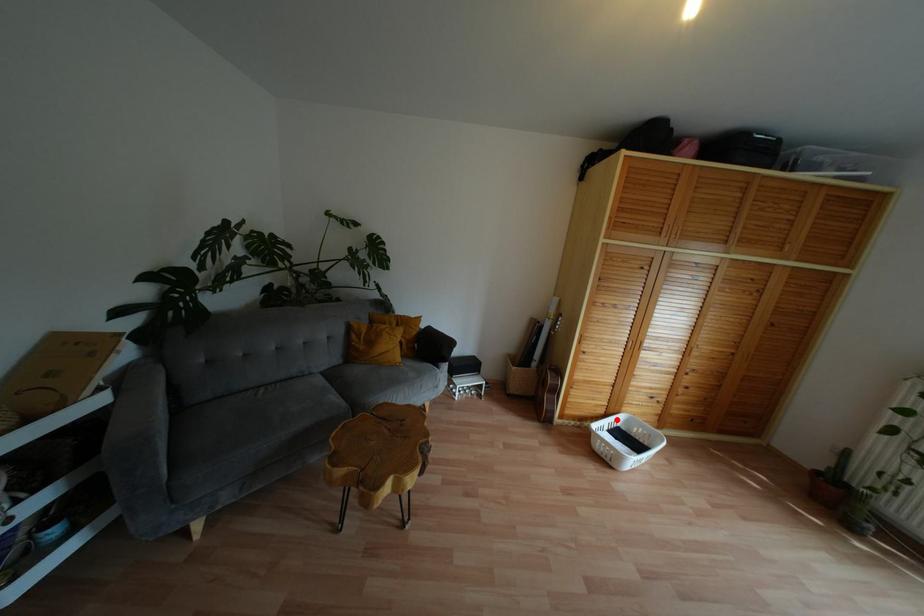
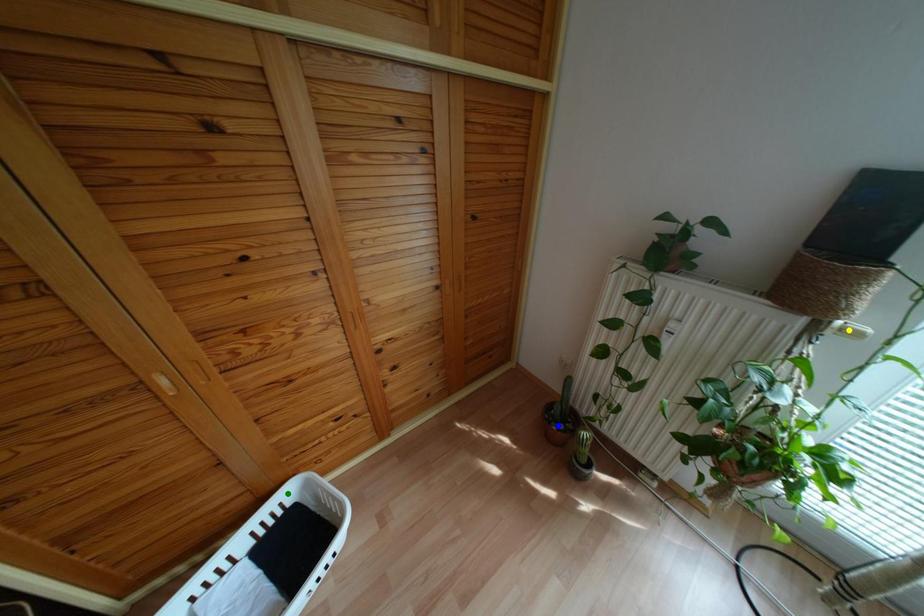
Question: I am providing you with two images of the same scene from different viewpoints. A red point is marked on the first image. You are given multiple points on the second image. Which point in image 2 is actually the same real-world point as the red point in image 1?

Choices:
 (A) yellow point
 (B) blue point
 (C) green point

Answer: (C)